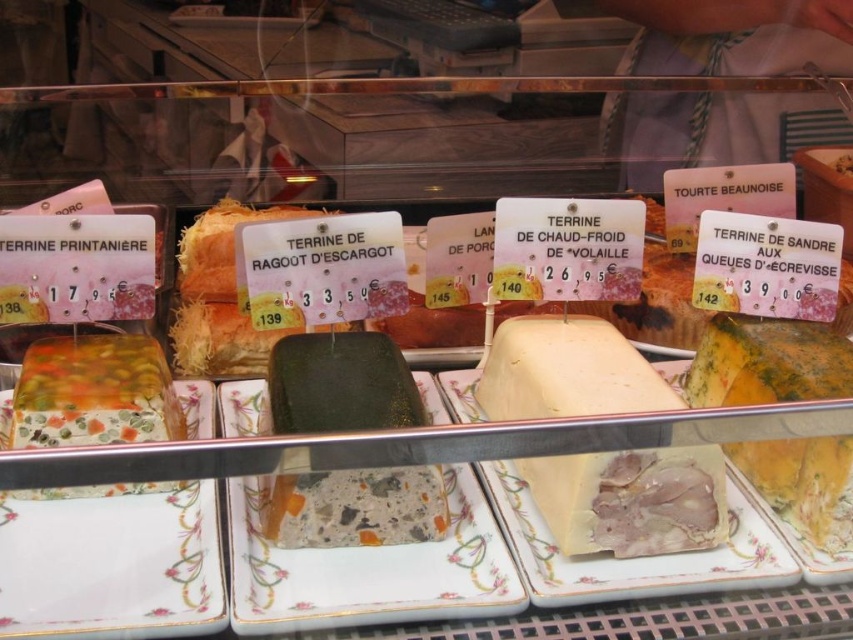
Can you confirm if white glossy terrine at center is positioned to the right of translucent gelatinous cube at center?

Correct, you'll find white glossy terrine at center to the right of translucent gelatinous cube at center.

Who is shorter, white glossy terrine at center or translucent gelatinous cube at center?

With less height is translucent gelatinous cube at center.

Is point (740, 545) less distant than point (149, 342)?

Yes.

The height and width of the screenshot is (640, 853). In order to click on white glossy terrine at center in this screenshot , I will do `click(631, 557)`.

Is speckled stone terrine at center bigger than white glossy terrine at center?

Incorrect, speckled stone terrine at center is not larger than white glossy terrine at center.

Who is lower down, speckled stone terrine at center or white glossy terrine at center?

white glossy terrine at center is below.

Between point (404, 376) and point (437, 378), which one is positioned in front?

Positioned in front is point (404, 376).

This screenshot has width=853, height=640. Find the location of `speckled stone terrine at center`. speckled stone terrine at center is located at coordinates click(x=340, y=385).

Does white smooth cheese at center have a greater height compared to floral-patterned ceramic platter at lower left?

Yes.

Which is more to the left, white smooth cheese at center or floral-patterned ceramic platter at lower left?

From the viewer's perspective, floral-patterned ceramic platter at lower left appears more on the left side.

Which is behind, point (604, 486) or point (167, 545)?

The point (167, 545) is behind.

Find the location of a particular element. This screenshot has height=640, width=853. white smooth cheese at center is located at coordinates (631, 499).